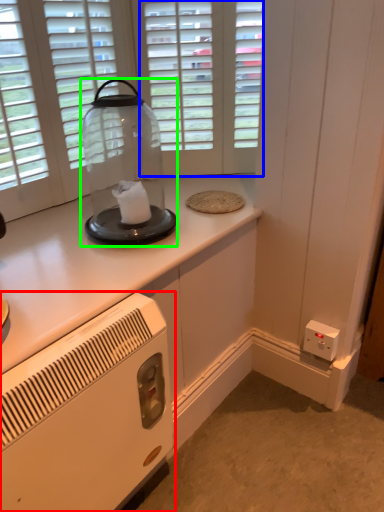
Question: Which object is positioned farthest from home appliance (highlighted by a red box)? Select from glass door (highlighted by a blue box) and glass jar (highlighted by a green box).

Choices:
 (A) glass door
 (B) glass jar

Answer: (A)